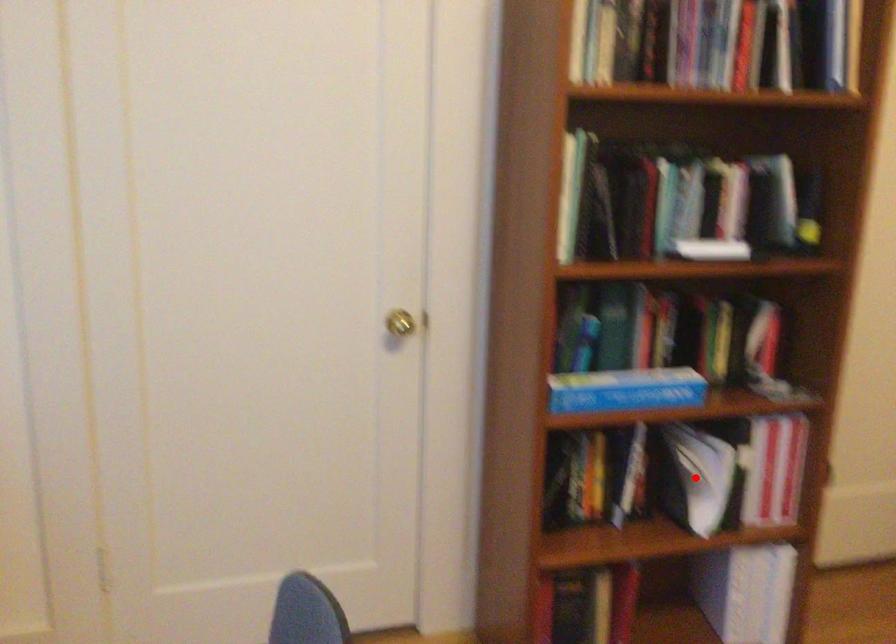
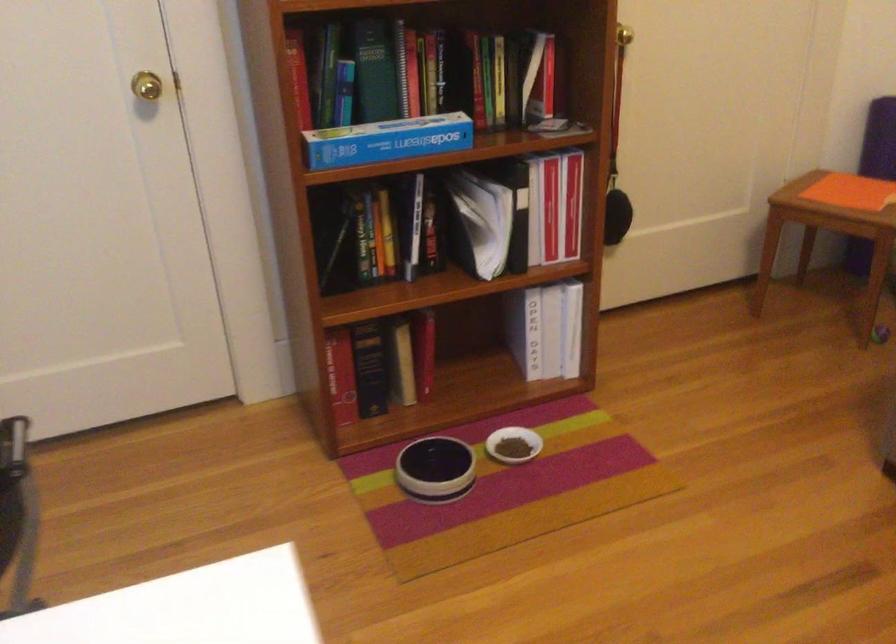
Where in the second image is the point corresponding to the highlighted location from the first image?

(479, 222)